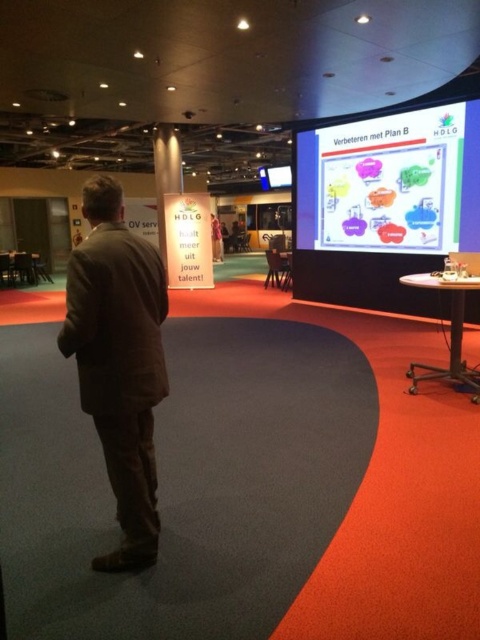
You are a photographer taking a picture of the scene. You need to ensure both the brown fabric suit at left and the whiteboard at upper center are visible in the frame. Given their heights, which object might require you to adjust your camera angle to capture fully?

The brown fabric suit at left has a lesser height compared to the whiteboard at upper center. Therefore, the brown fabric suit at left may require adjusting the camera angle to ensure it is fully captured in the frame.

You are a photographer standing at the entrance of the conference room and want to take a photo of the brown fabric suit at left and the HDLG banner at right. The camera you are using has a maximum focus range of 1.8 meters. Can you capture both subjects in focus without moving your position?

The brown fabric suit at left and the HDLG banner at right are 1.85 meters apart, which exceeds the camera maximum focus range of 1.8 meters. Therefore, you cannot capture both subjects in focus without moving your position.

You are an attendee at the event and want to move from your seat to the whiteboard at upper center without passing through the brown fabric suit at left. Is there enough space between them for you to walk through?

The brown fabric suit at left has a lesser width compared to the whiteboard at upper center, so there is sufficient space to walk between them without passing through the brown fabric suit at left.